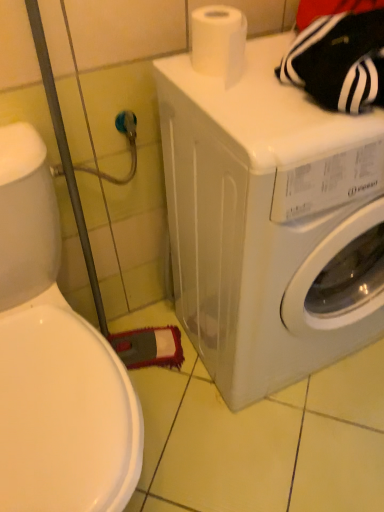
This screenshot has width=384, height=512. Describe the element at coordinates (270, 223) in the screenshot. I see `white plastic washing machine at center` at that location.

Image resolution: width=384 pixels, height=512 pixels. Find the location of `white plastic washing machine at center`. white plastic washing machine at center is located at coordinates (270, 223).

At what (x,y) coordinates should I click in order to perform the action: click on white matte toilet paper at upper center. Please return your answer as a coordinate pair (x, y). Looking at the image, I should click on (218, 42).

What do you see at coordinates (218, 42) in the screenshot? This screenshot has height=512, width=384. I see `white matte toilet paper at upper center` at bounding box center [218, 42].

What are the coordinates of `white plastic washing machine at center` in the screenshot? It's located at coord(270,223).

Is white plastic washing machine at center to the right of white matte toilet paper at upper center from the viewer's perspective?

Yes.

Does white plastic washing machine at center lie in front of white matte toilet paper at upper center?

Yes, it is.

Does point (239, 263) appear closer or farther from the camera than point (232, 8)?

Point (239, 263) is closer to the camera than point (232, 8).

From the image's perspective, is white plastic washing machine at center below white matte toilet paper at upper center?

Indeed, from the image's perspective, white plastic washing machine at center is shown beneath white matte toilet paper at upper center.

From a real-world perspective, is white plastic washing machine at center positioned under white matte toilet paper at upper center based on gravity?

Correct, in the physical world, white plastic washing machine at center is lower than white matte toilet paper at upper center.

Considering the sizes of white plastic washing machine at center and white matte toilet paper at upper center in the image, is white plastic washing machine at center wider or thinner than white matte toilet paper at upper center?

Clearly, white plastic washing machine at center has more width compared to white matte toilet paper at upper center.

Considering the relative sizes of white plastic washing machine at center and white matte toilet paper at upper center in the image provided, is white plastic washing machine at center taller than white matte toilet paper at upper center?

Correct, white plastic washing machine at center is much taller as white matte toilet paper at upper center.

Is white plastic washing machine at center smaller than white matte toilet paper at upper center?

Incorrect, white plastic washing machine at center is not smaller in size than white matte toilet paper at upper center.

Would you say white plastic washing machine at center is inside or outside white matte toilet paper at upper center?

white plastic washing machine at center lies outside white matte toilet paper at upper center.

Is white plastic washing machine at center beside white matte toilet paper at upper center?

white plastic washing machine at center and white matte toilet paper at upper center are clearly separated.

Is white plastic washing machine at center oriented towards white matte toilet paper at upper center?

No, white plastic washing machine at center is not oriented towards white matte toilet paper at upper center.

Where is `washing machine in front of the white matte toilet paper at upper center`? washing machine in front of the white matte toilet paper at upper center is located at coordinates (270, 223).

Which is more to the left, white matte toilet paper at upper center or white plastic washing machine at center?

From the viewer's perspective, white matte toilet paper at upper center appears more on the left side.

Is white matte toilet paper at upper center in front of white plastic washing machine at center?

No, white matte toilet paper at upper center is further to the viewer.

Is point (224, 19) closer or farther from the camera than point (237, 93)?

Point (224, 19) is positioned closer to the camera compared to point (237, 93).

From the image's perspective, is white matte toilet paper at upper center on top of white plastic washing machine at center?

Yes, from the image's perspective, white matte toilet paper at upper center is on top of white plastic washing machine at center.

From a real-world perspective, is white matte toilet paper at upper center positioned above or below white plastic washing machine at center?

Clearly, from a real-world perspective, white matte toilet paper at upper center is above white plastic washing machine at center.

Can you confirm if white matte toilet paper at upper center is thinner than white plastic washing machine at center?

Yes, white matte toilet paper at upper center is thinner than white plastic washing machine at center.

Which of these two, white matte toilet paper at upper center or white plastic washing machine at center, stands shorter?

white matte toilet paper at upper center is shorter.

Considering the sizes of objects white matte toilet paper at upper center and white plastic washing machine at center in the image provided, who is smaller, white matte toilet paper at upper center or white plastic washing machine at center?

Smaller between the two is white matte toilet paper at upper center.

Consider the image. Is white matte toilet paper at upper center inside the boundaries of white plastic washing machine at center, or outside?

white matte toilet paper at upper center lies outside white plastic washing machine at center.

Is white matte toilet paper at upper center not close to white plastic washing machine at center?

They are positioned close to each other.

Is white matte toilet paper at upper center oriented away from white plastic washing machine at center?

No.

Measure the distance between white matte toilet paper at upper center and white plastic washing machine at center.

The distance of white matte toilet paper at upper center from white plastic washing machine at center is 33.45 centimeters.

Locate an element on the screen. The width and height of the screenshot is (384, 512). washing machine on the right of white matte toilet paper at upper center is located at coordinates (270, 223).

Identify the location of washing machine in front of the white matte toilet paper at upper center. (270, 223).

I want to click on toilet paper that appears on the left of white plastic washing machine at center, so click(218, 42).